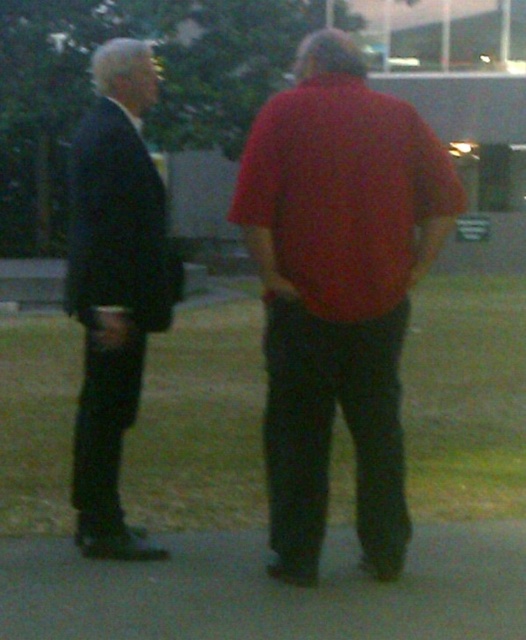
You are a security camera monitoring the area. You need to locate the matte red shirt at center in your camera feed. What are the coordinates where you should focus your zoom lens?

The coordinates for the matte red shirt at center are at point (338, 291).

You are a photographer setting up a shot of the matte red shirt at center and the matte black suit at left. To ensure both subjects are in focus, where should you position the camera relative to their current positions?

Since the matte red shirt at center is below the matte black suit at left, you should position the camera at a lower angle to capture both subjects in focus, ensuring the lens can adequately focus on both the lower and higher positioned subjects.